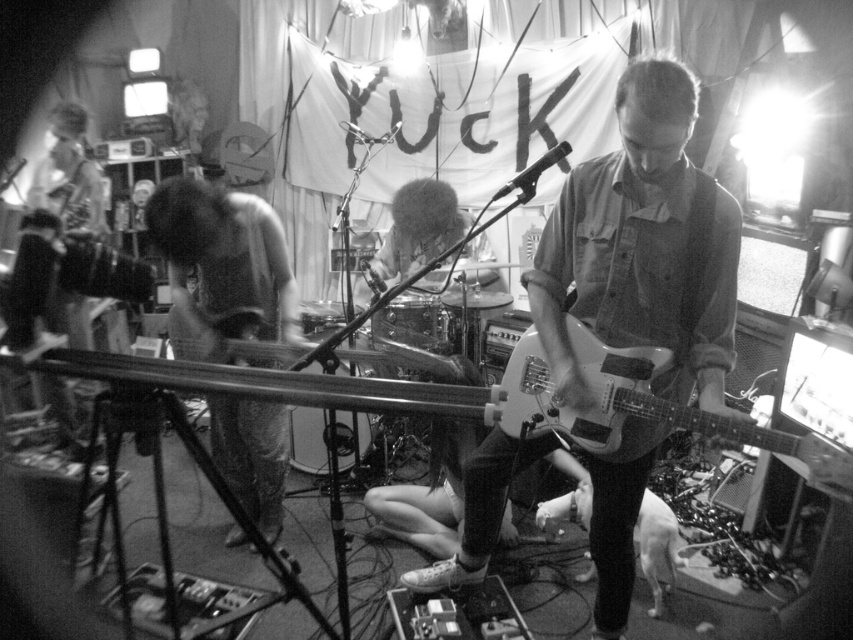
You are a photographer standing at the camera position. You want to place a spotlight on the point at coordinate point [682,129]. The spotlight has a minimum range of 5 feet. Will the spotlight reach the point?

The distance of point [682,129] from camera is 4.98 feet, which is slightly less than the spotlight minimum range of 5 feet. Therefore, the spotlight will not reach the point.

You are a photographer setting up for a live music shoot. You have two guitars on stage, the matte white guitar at center and the white glossy guitar at center. The venue requires that the guitars must be at least 20 centimeters apart for proper lighting. Are the guitars positioned correctly according to the requirement?

The matte white guitar at center and the white glossy guitar at center are 18.56 centimeters apart from each other, which is less than the required 20 centimeters. Therefore, the guitars are not positioned correctly according to the venue requirements.

You are a photographer at the live music performance. You want to take a photo of the white glossy guitar at center without including the denim pants at left in the frame. Is this possible based on their positions?

The denim pants at left is above the white glossy guitar at center, so if you position your camera to focus on the lower part where the white glossy guitar at center is located, you can exclude the denim pants at left from the frame.